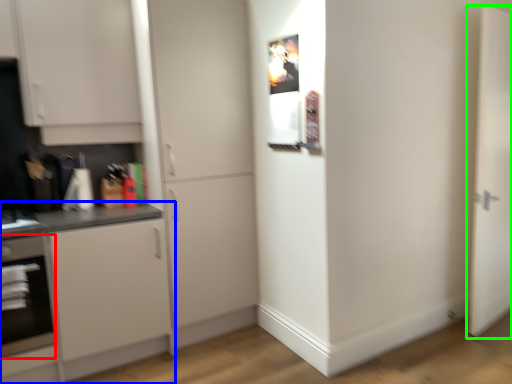
Question: Estimate the real-world distances between objects in this image. Which object is farther from oven (highlighted by a red box), cabinetry (highlighted by a blue box) or door (highlighted by a green box)?

Choices:
 (A) cabinetry
 (B) door

Answer: (B)